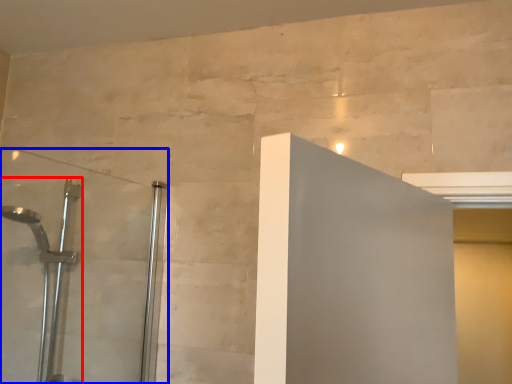
Question: Which of the following is the closest to the observer, shower (highlighted by a red box) or shower door (highlighted by a blue box)?

Choices:
 (A) shower
 (B) shower door

Answer: (B)